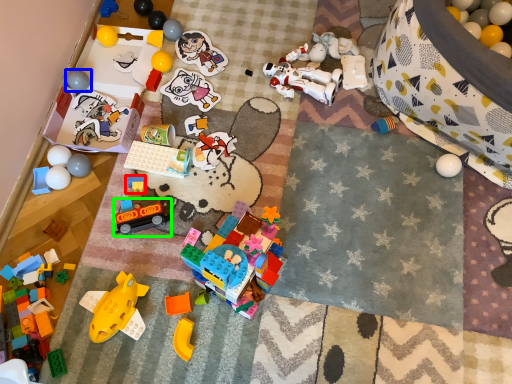
Question: Based on their relative distances, which object is nearer to toy (highlighted by a red box)? Choose from toy (highlighted by a blue box) and toy (highlighted by a green box).

Choices:
 (A) toy
 (B) toy

Answer: (B)